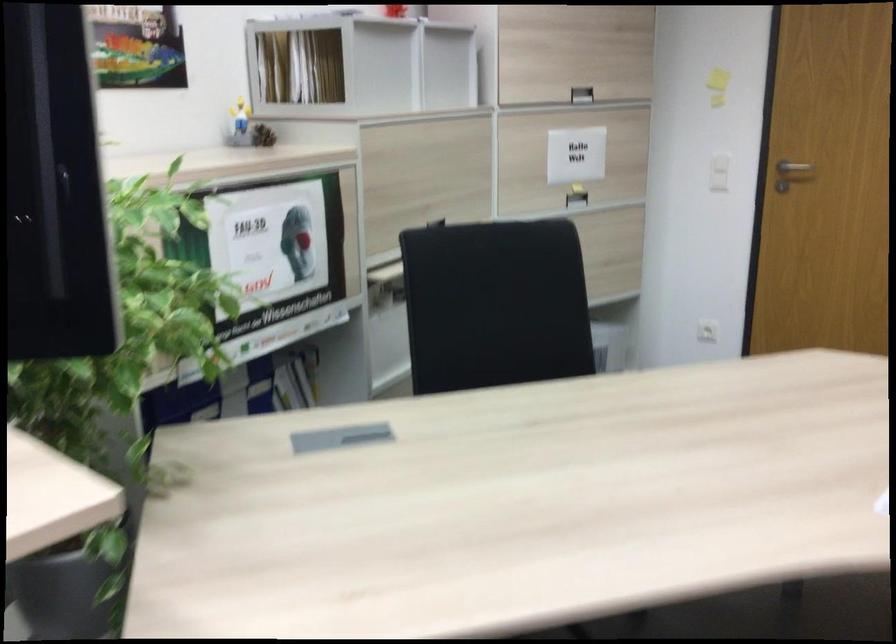
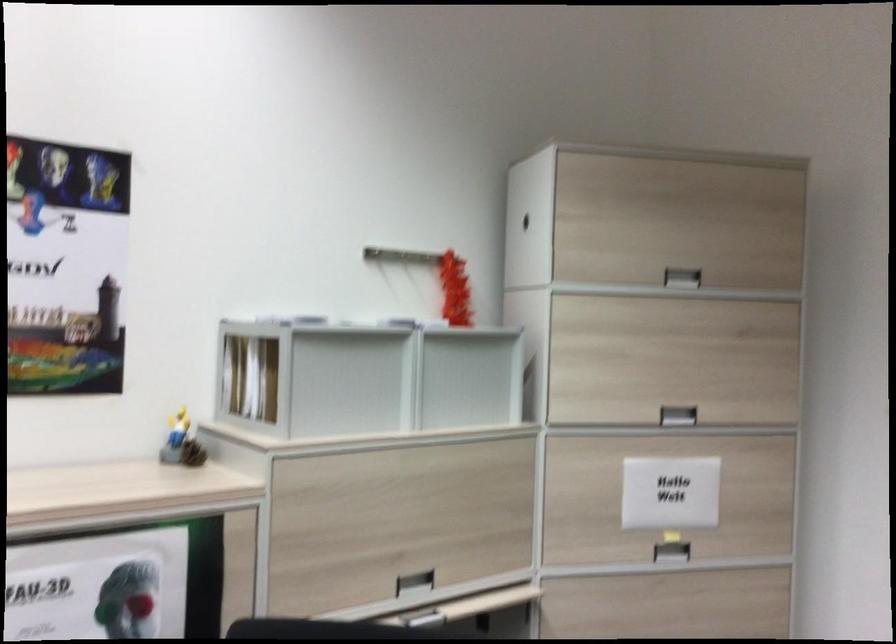
The images are taken continuously from a first-person perspective. In which direction are you moving?

The movement direction of the cameraman is right, forward.